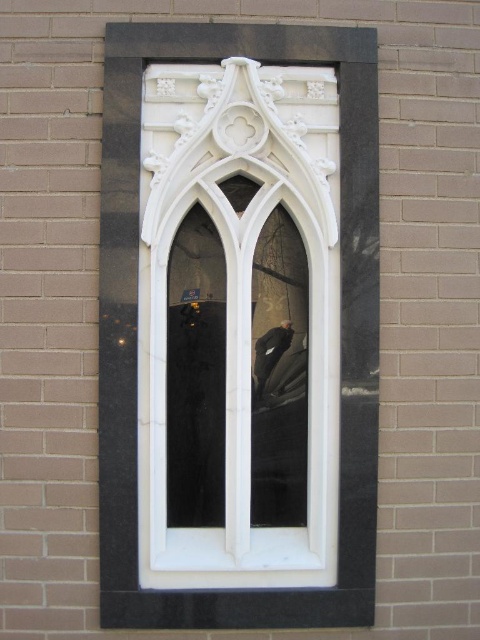
Between white marble window frame at center and dark brown leather jacket at center, which one is positioned lower?

dark brown leather jacket at center is below.

Describe the element at coordinates (136, 316) in the screenshot. This screenshot has height=640, width=480. I see `white marble window frame at center` at that location.

This screenshot has height=640, width=480. In order to click on white marble window frame at center in this screenshot , I will do `click(136, 316)`.